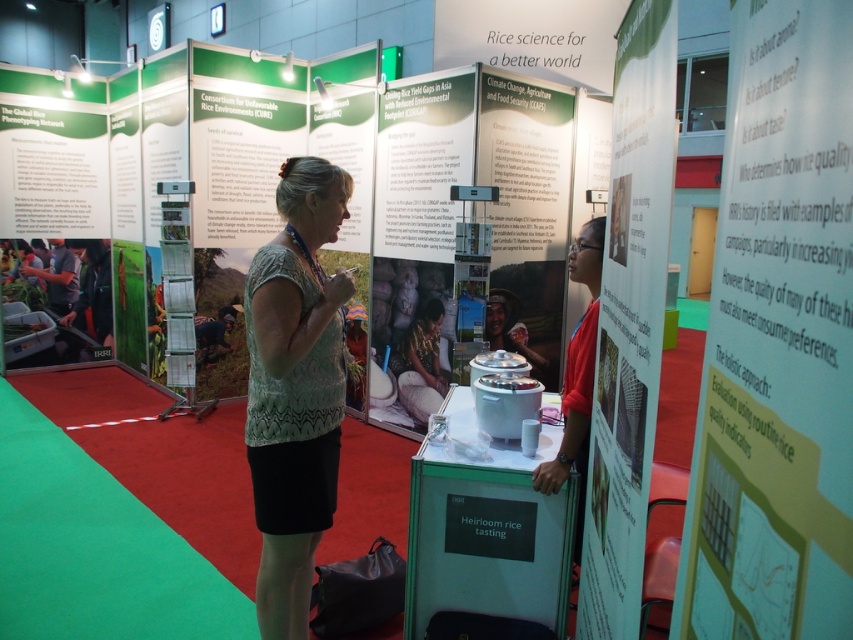
Who is lower down, white paper at upper right or green textured blouse at center?

Positioned lower is green textured blouse at center.

Which of these two, white paper at upper right or green textured blouse at center, stands taller?

Standing taller between the two is green textured blouse at center.

Is point (737, 413) less distant than point (287, 586)?

Yes, point (737, 413) is closer to viewer.

The image size is (853, 640). I want to click on white paper at upper right, so click(776, 342).

Is white paper at upper right shorter than white paper at center?

Yes, white paper at upper right is shorter than white paper at center.

Does white paper at upper right appear on the right side of white paper at center?

Incorrect, white paper at upper right is not on the right side of white paper at center.

I want to click on white paper at upper right, so click(776, 342).

Does point (630, 497) come behind point (291, 449)?

No.

Between white paper at center and green textured blouse at center, which one is positioned lower?

green textured blouse at center

This screenshot has width=853, height=640. Find the location of `white paper at center`. white paper at center is located at coordinates (630, 321).

What are the coordinates of `white paper at center` in the screenshot? It's located at (630, 321).